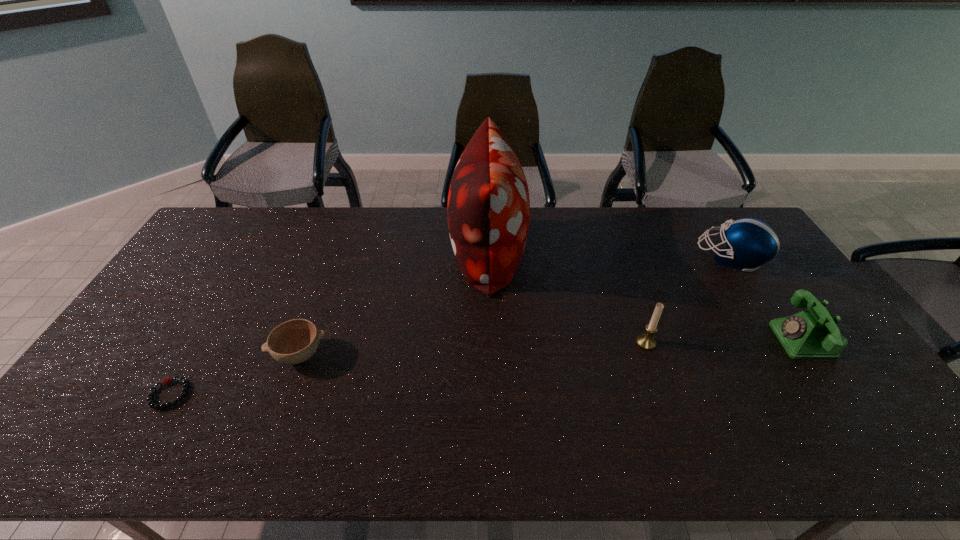
This screenshot has height=540, width=960. I want to click on free space located 0.240m on the front-facing side of the third object from left to right, so click(x=380, y=252).

Identify the location of free space located 0.230m on the front-facing side of the third object from left to right. (383, 252).

At what (x,y) coordinates should I click in order to perform the action: click on vacant space situated 0.180m at the front of the football helmet with the faceguard. Please return your answer as a coordinate pair (x, y). Looking at the image, I should click on (647, 258).

Locate an element on the screen. The height and width of the screenshot is (540, 960). free region located 0.090m at the front of the football helmet with the faceguard is located at coordinates (674, 258).

Identify the location of free region located at the front of the football helmet with the faceguard. (656, 258).

Find the location of a particular element. vacant space located 0.240m on the right of the candle holder is located at coordinates (741, 343).

The image size is (960, 540). In order to click on free spot located on the dial of the telephone in this screenshot , I will do `click(642, 340)`.

Locate an element on the screen. Image resolution: width=960 pixels, height=540 pixels. blank area located 0.250m on the dial of the telephone is located at coordinates (689, 340).

The image size is (960, 540). What are the coordinates of `free spot located on the dial of the telephone` in the screenshot? It's located at (636, 340).

At what (x,y) coordinates should I click in order to perform the action: click on vacant region located 0.340m on the back of the second shortest object. Please return your answer as a coordinate pair (x, y). The width and height of the screenshot is (960, 540). Looking at the image, I should click on (335, 258).